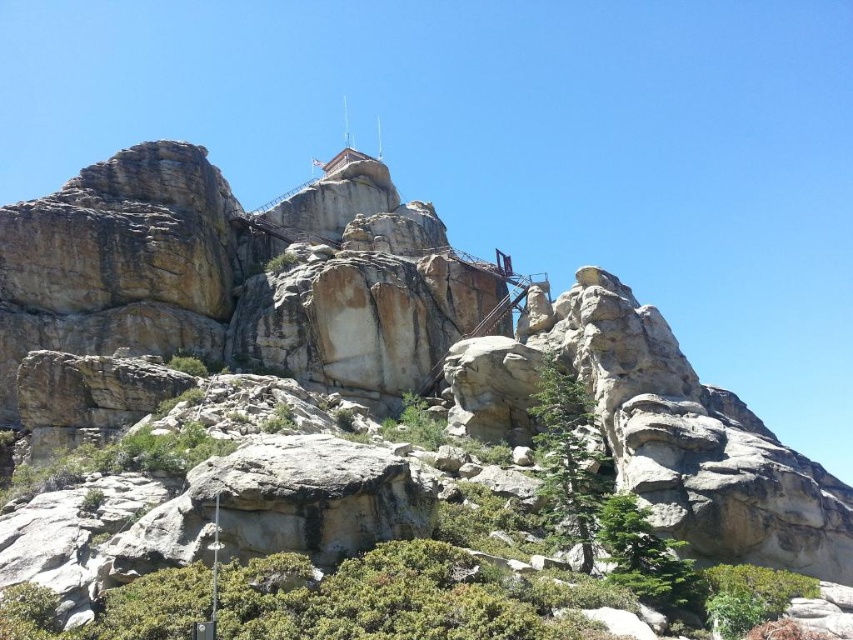
What do you see at coordinates (567, 460) in the screenshot?
I see `green textured tree at center` at bounding box center [567, 460].

Consider the image. Can you confirm if green textured tree at center is smaller than green leafy shrub at lower right?

Actually, green textured tree at center might be larger than green leafy shrub at lower right.

Where is `green textured tree at center`? This screenshot has width=853, height=640. green textured tree at center is located at coordinates (567, 460).

Between green textured tree at center and green textured tree at lower center, which one appears on the left side from the viewer's perspective?

green textured tree at center is more to the left.

Can you confirm if green textured tree at center is thinner than green textured tree at lower center?

Yes.

Between point (587, 492) and point (689, 586), which one is positioned in front?

Point (689, 586)

Where is `green textured tree at center`? green textured tree at center is located at coordinates (567, 460).

Between point (671, 554) and point (718, 628), which one is positioned behind?

Positioned behind is point (671, 554).

Describe the element at coordinates (645, 556) in the screenshot. I see `green textured tree at lower center` at that location.

You are a GUI agent. You are given a task and a screenshot of the screen. Output one action in this format:
    pyautogui.click(x=<x>, y=<y>)
    Task: Click on the green textured tree at lower center
    The height and width of the screenshot is (640, 853).
    Given the screenshot: What is the action you would take?
    pyautogui.click(x=645, y=556)